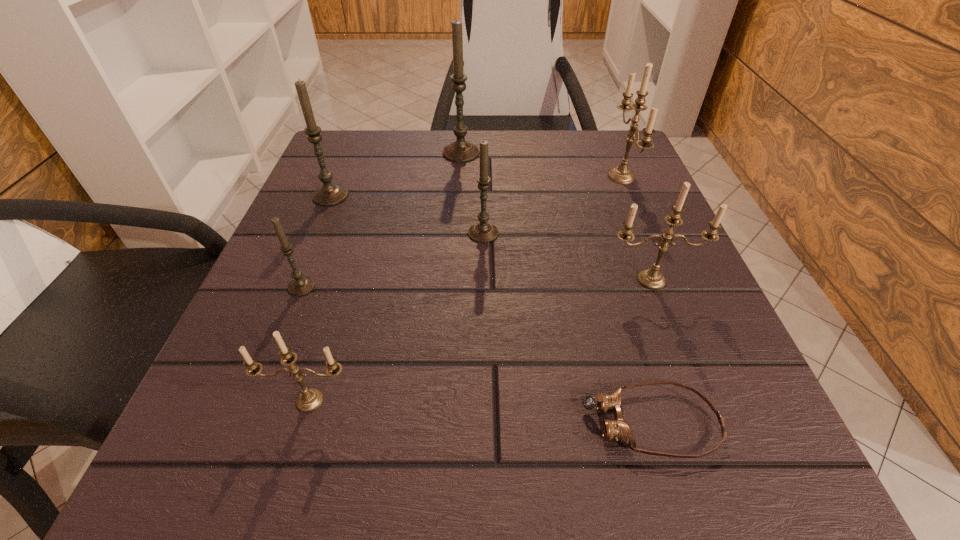
Locate an element on the screen. goggles is located at coordinates (618, 429).

Identify the location of vacant space located 0.130m on the front of the farthest gray candle. (459, 198).

Where is `vacant space located on the left of the farthest metallic candle`? vacant space located on the left of the farthest metallic candle is located at coordinates (444, 177).

The width and height of the screenshot is (960, 540). In order to click on vacant position located 0.120m on the right of the second biggest gray candle in this screenshot , I will do `click(410, 196)`.

This screenshot has height=540, width=960. In order to click on free region located 0.250m on the right of the third biggest gray candle in this screenshot , I will do `click(640, 233)`.

You are a GUI agent. You are given a task and a screenshot of the screen. Output one action in this format:
    pyautogui.click(x=<x>, y=<y>)
    Task: Click on the vacant space located on the left of the second farthest metallic candle
    
    Given the screenshot: What is the action you would take?
    pyautogui.click(x=453, y=280)

You are a GUI agent. You are given a task and a screenshot of the screen. Output one action in this format:
    pyautogui.click(x=<x>, y=<y>)
    Task: Click on the vacant space located on the back of the nearest gray candle
    This screenshot has height=540, width=960.
    Given the screenshot: What is the action you would take?
    pyautogui.click(x=348, y=167)

Find the location of a particular element. blank space located on the right of the nearest candle is located at coordinates (482, 400).

You are a GUI agent. You are given a task and a screenshot of the screen. Output one action in this format:
    pyautogui.click(x=<x>, y=<y>)
    Task: Click on the blank space located 0.370m on the front lenses and sides of the goggles
    Image resolution: width=960 pixels, height=540 pixels.
    Given the screenshot: What is the action you would take?
    pyautogui.click(x=275, y=422)

Identify the location of blank space located 0.290m on the front lenses and sides of the goggles. This screenshot has width=960, height=540. (341, 422).